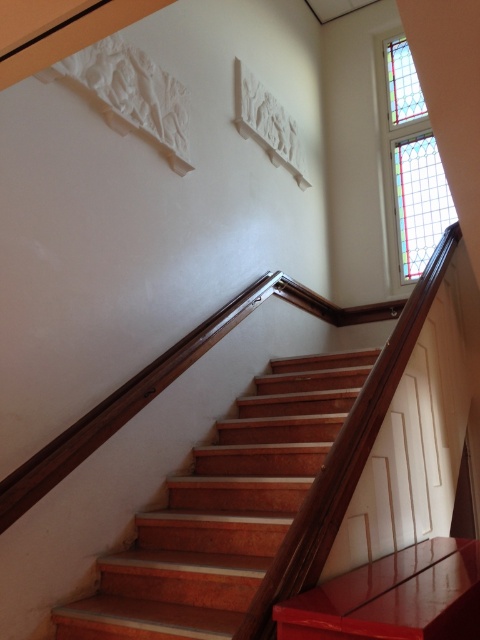
Question: Can you confirm if wooden stairs at center is wider than stained glass window at upper right?

Choices:
 (A) yes
 (B) no

Answer: (A)

Question: Which point is farther to the camera?

Choices:
 (A) (396, 161)
 (B) (265, 400)

Answer: (A)

Question: Can you confirm if wooden stairs at center is bigger than stained glass window at upper right?

Choices:
 (A) yes
 (B) no

Answer: (A)

Question: Can you confirm if wooden stairs at center is positioned above stained glass window at upper right?

Choices:
 (A) no
 (B) yes

Answer: (A)

Question: Which point is farther to the camera?

Choices:
 (A) (443, 189)
 (B) (122, 593)

Answer: (A)

Question: Which of the following is the farthest from the observer?

Choices:
 (A) wooden stairs at center
 (B) stained glass window at upper right

Answer: (B)